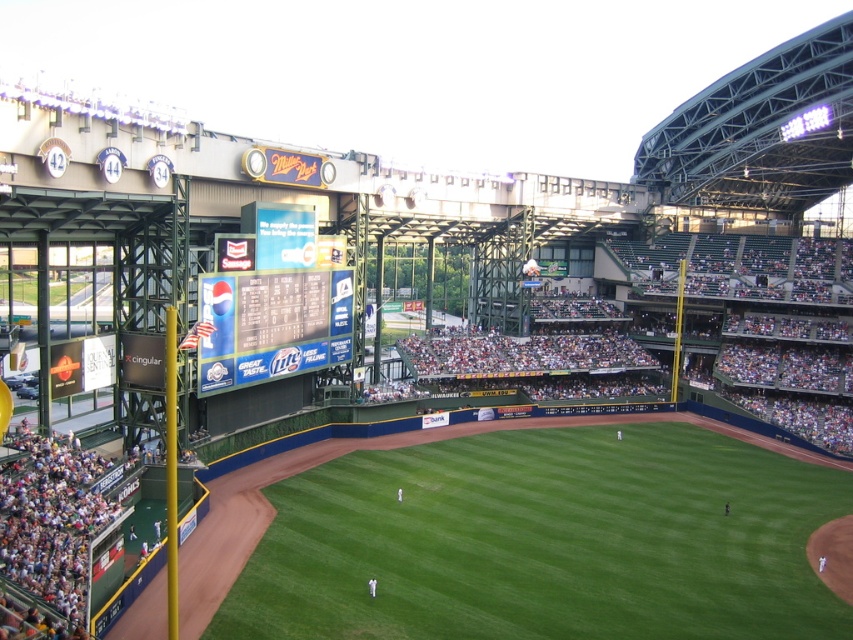
Does green grass field at center appear on the left side of blue glossy scoreboard at center?

No, green grass field at center is not to the left of blue glossy scoreboard at center.

I want to click on green grass field at center, so click(x=544, y=541).

Image resolution: width=853 pixels, height=640 pixels. Identify the location of green grass field at center. (544, 541).

Which is behind, point (776, 545) or point (733, 339)?

Positioned behind is point (733, 339).

Can you confirm if green grass field at center is positioned above dark green seats at center?

Actually, green grass field at center is below dark green seats at center.

Where is `green grass field at center`? Image resolution: width=853 pixels, height=640 pixels. green grass field at center is located at coordinates (544, 541).

The width and height of the screenshot is (853, 640). In order to click on green grass field at center in this screenshot , I will do `click(544, 541)`.

Who is more forward, (817, 336) or (287, 365)?

Positioned in front is point (287, 365).

The height and width of the screenshot is (640, 853). What do you see at coordinates (743, 324) in the screenshot?
I see `dark green seats at center` at bounding box center [743, 324].

Does point (631, 291) come closer to viewer compared to point (213, 371)?

No, (631, 291) is behind (213, 371).

Identify the location of dark green seats at center. Image resolution: width=853 pixels, height=640 pixels. (743, 324).